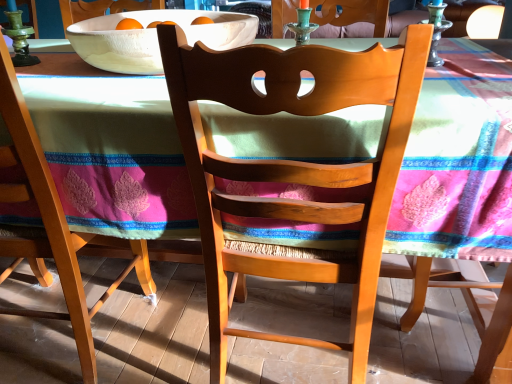
This screenshot has height=384, width=512. I want to click on free point to the right of green glass candle holder at upper right, the second candle holder in the left-to-right sequence, so click(470, 61).